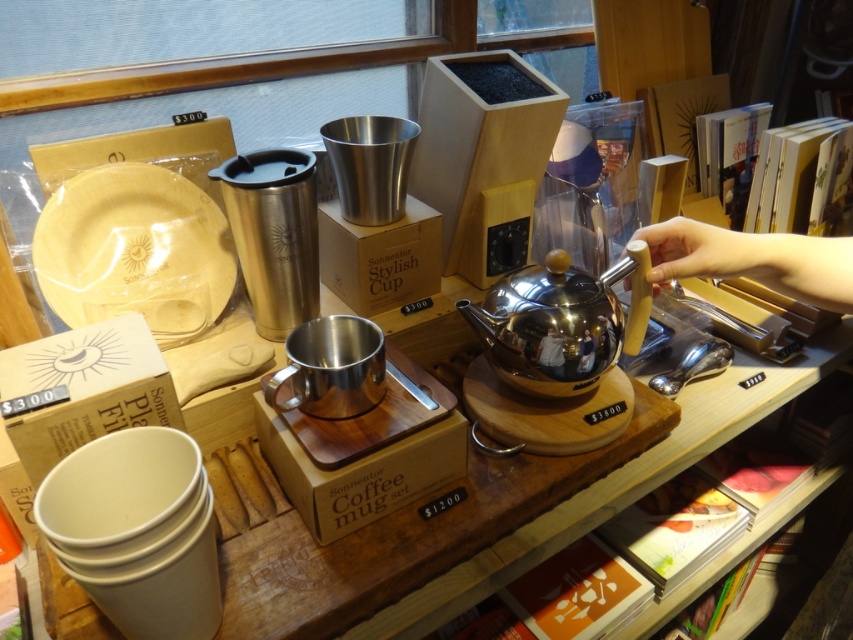
You are a customer looking to buy a teapot and a plate for a gift set. The store requires that the items must be of different sizes. Based on the scene, can you confirm if the shiny stainless steel teapot at center and the natural wood plate at left meet this requirement?

The shiny stainless steel teapot at center is bigger than natural wood plate at left, so they are different in size and meet the store requirement.

You are a customer looking at the kitchenware display. You see the natural wood plate at left. Where exactly is it positioned relative to the other items?

The natural wood plate at left is located at point coordinates of 0.392 on the x axis and 0.158 on the y axis.